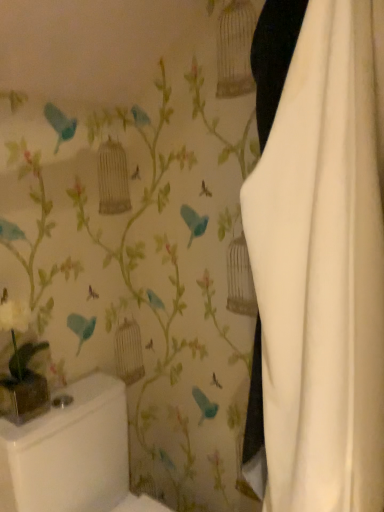
Question: Is white fabric curtain at right in front of or behind white glossy toilet bowl at lower left in the image?

Choices:
 (A) behind
 (B) front

Answer: (B)

Question: In terms of size, does white fabric curtain at right appear bigger or smaller than white glossy toilet bowl at lower left?

Choices:
 (A) big
 (B) small

Answer: (B)

Question: From the image's perspective, is white fabric curtain at right located above or below white glossy toilet bowl at lower left?

Choices:
 (A) above
 (B) below

Answer: (A)

Question: Is point (79, 443) positioned closer to the camera than point (302, 119)?

Choices:
 (A) closer
 (B) farther

Answer: (B)

Question: Relative to white fabric curtain at right, is white glossy toilet bowl at lower left in front or behind?

Choices:
 (A) front
 (B) behind

Answer: (B)

Question: From the image's perspective, is white glossy toilet bowl at lower left positioned above or below white fabric curtain at right?

Choices:
 (A) below
 (B) above

Answer: (A)

Question: Is white glossy toilet bowl at lower left inside the boundaries of white fabric curtain at right, or outside?

Choices:
 (A) inside
 (B) outside

Answer: (B)